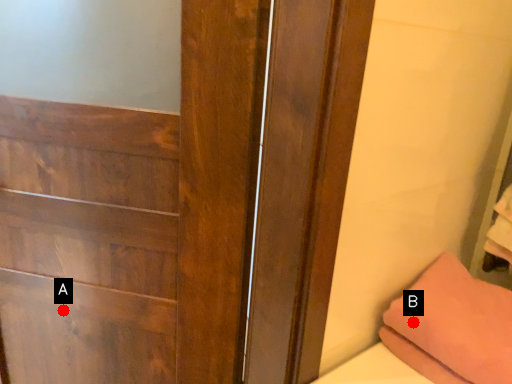
Question: Two points are circled on the image, labeled by A and B beside each circle. Which point is closer to the camera?

Choices:
 (A) A is closer
 (B) B is closer

Answer: (B)